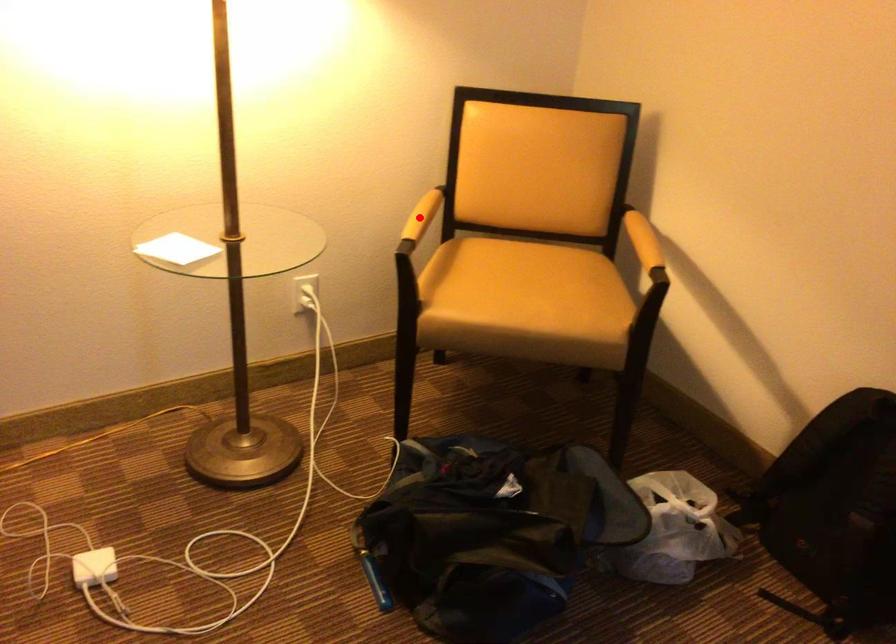
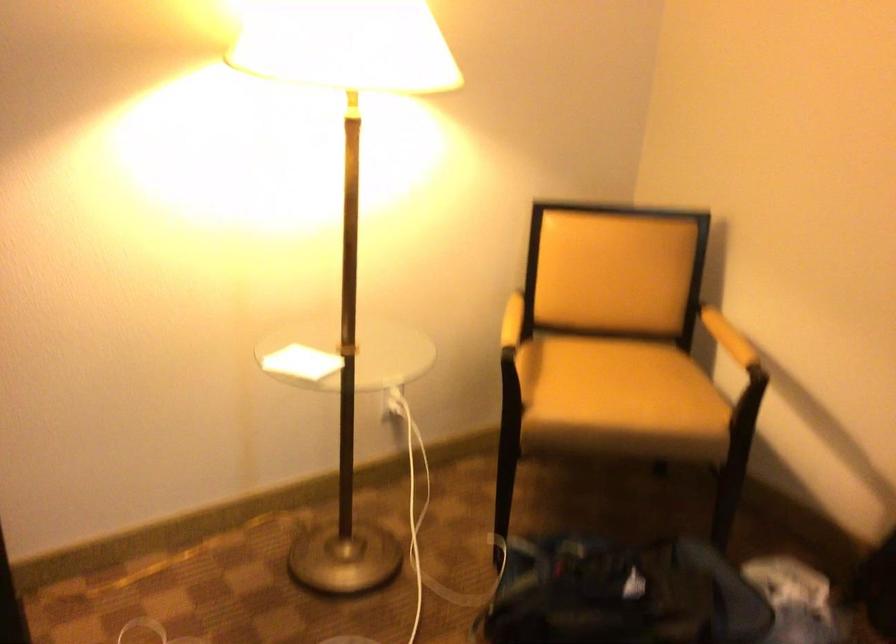
Question: I am providing you with two images of the same scene from different viewpoints. A red point is marked on the first image. At the location where the point appears in image 1, is it still visible in image 2?

Choices:
 (A) Yes
 (B) No

Answer: (A)